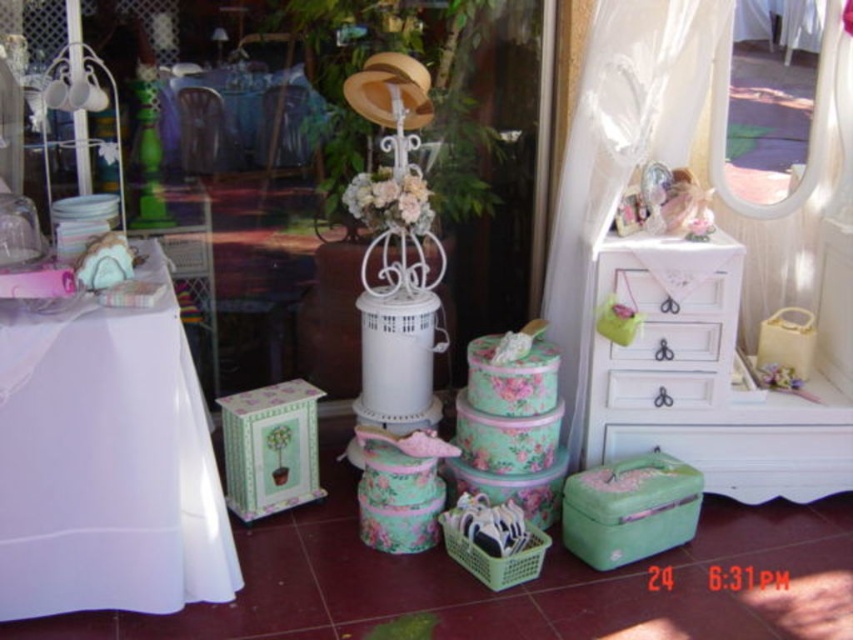
You are organizing a vintage shop and need to place a new item between the white painted wood dresser at right and the white painted wood drawers at right. Based on their positions, which side of the dresser should you place the item to ensure it is between them?

The white painted wood dresser at right is to the right of the white painted wood drawers at right, so placing the item to the left side of the dresser would place it between the two.

You are standing in the shop and want to place a new hat box on the white fabric table at left. If the hat box is 0.5 meters wide, will it fit on the table?

The distance between you and the white fabric table at left is 1.73 meters, but this detail doesn not indicate the table s size. Without knowing the table s dimensions, it s impossible to determine if the hat box will fit.